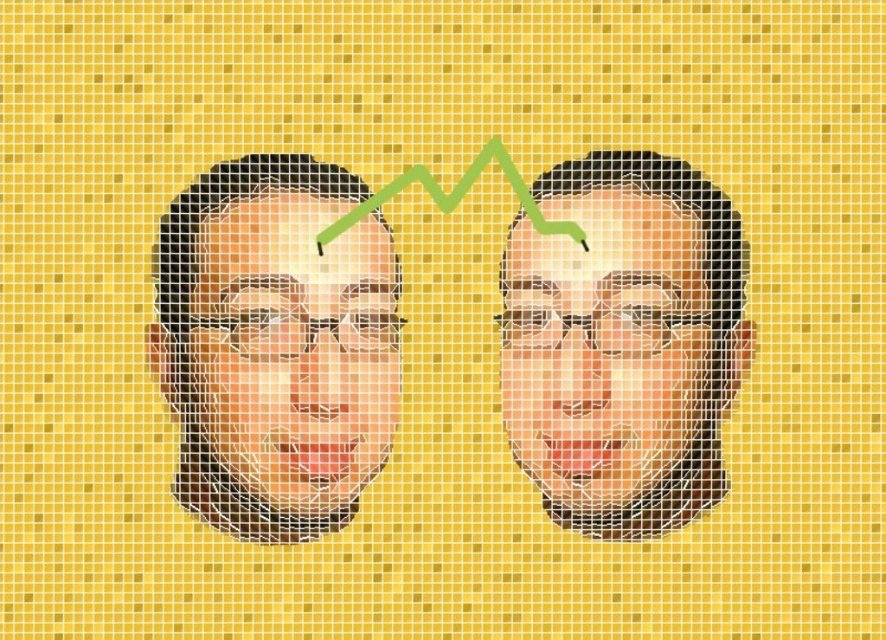
You are an artist analyzing the image. You notice two faces at the center, one labeled as smooth skin face at center and the other as matte black face at center. The image has a green line graph running between them. Based on the description, which face is narrower in width?

The smooth skin face at center is thinner than the matte black face at center, so the smooth skin face at center is narrower in width.

You are an artist analyzing a digital artwork. The scene shows two faces side by side with a green line graph between them. The objects are smooth skin face at center and matte black face at center. Which face is taller?

The matte black face at center is taller than the smooth skin face at center.